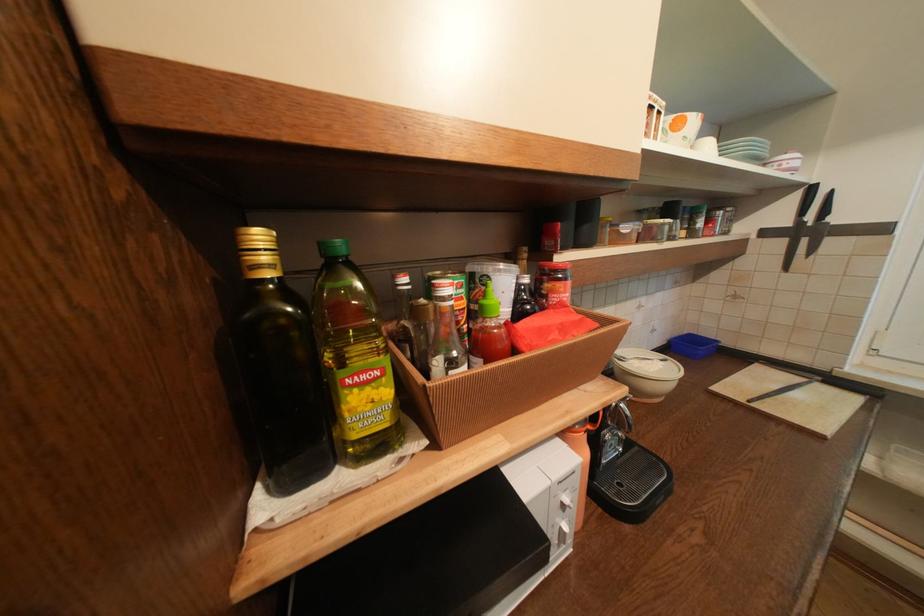
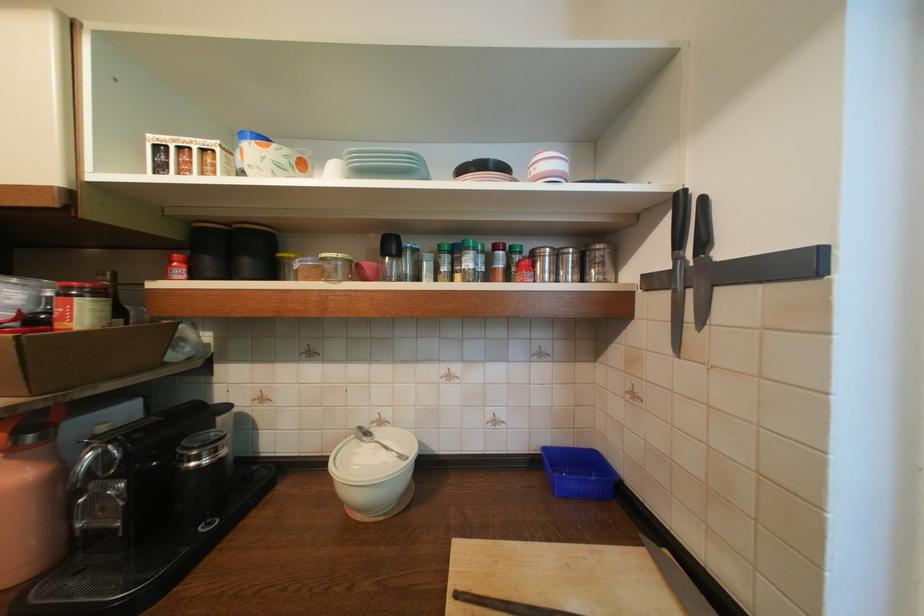
Locate, in the second image, the point that corresponds to the point at 811,257 in the first image.

(701, 326)